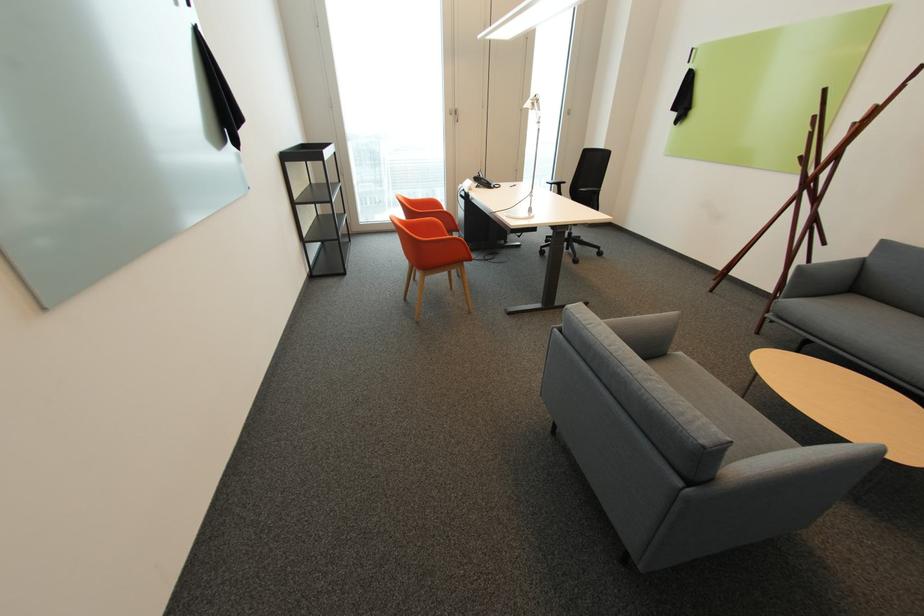
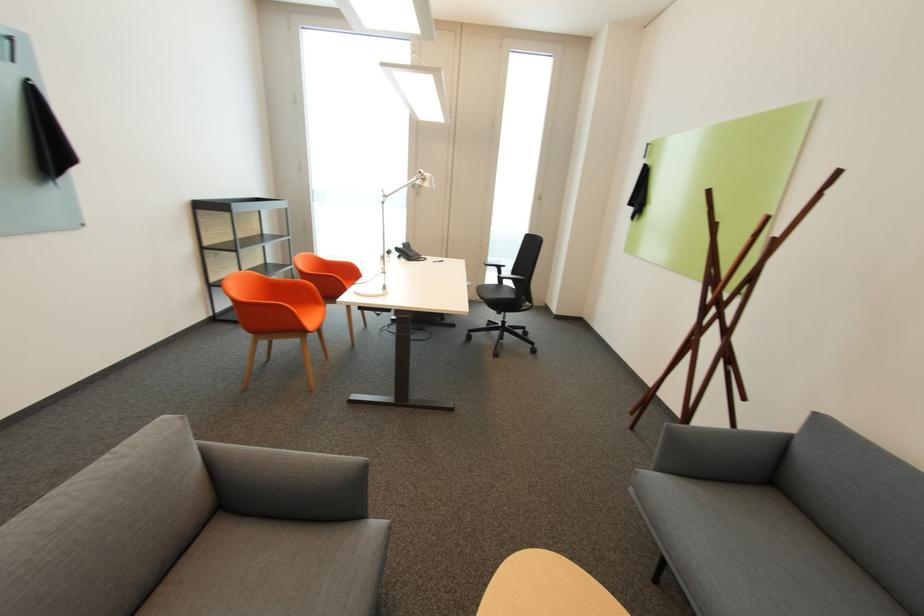
In the second image, find the point that corresponds to [497,185] in the first image.

(419, 259)